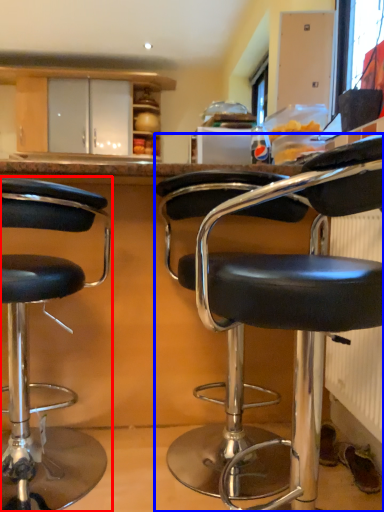
Question: Which point is further to the camera, chair (highlighted by a red box) or chair (highlighted by a blue box)?

Choices:
 (A) chair
 (B) chair

Answer: (A)